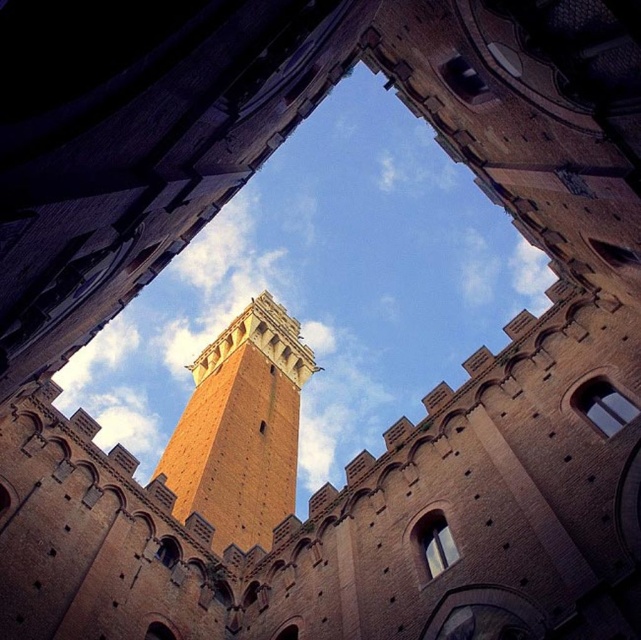
Question: Which point is farther to the camera?

Choices:
 (A) brick tower at center
 (B) clear glass window at center
 (C) matte glass window at center

Answer: (A)

Question: Is brick tower at center above clear glass window at center?

Choices:
 (A) no
 (B) yes

Answer: (B)

Question: Which is nearer to the clear glass window at center?

Choices:
 (A) matte glass window at center
 (B) brick tower at center

Answer: (A)

Question: Is matte glass window at center to the left of clear glass window at center from the viewer's perspective?

Choices:
 (A) yes
 (B) no

Answer: (B)

Question: Does brick tower at center appear on the left side of clear glass window at center?

Choices:
 (A) yes
 (B) no

Answer: (A)

Question: Which point is closer to the camera?

Choices:
 (A) click(x=272, y=522)
 (B) click(x=429, y=525)
 (C) click(x=628, y=403)

Answer: (C)